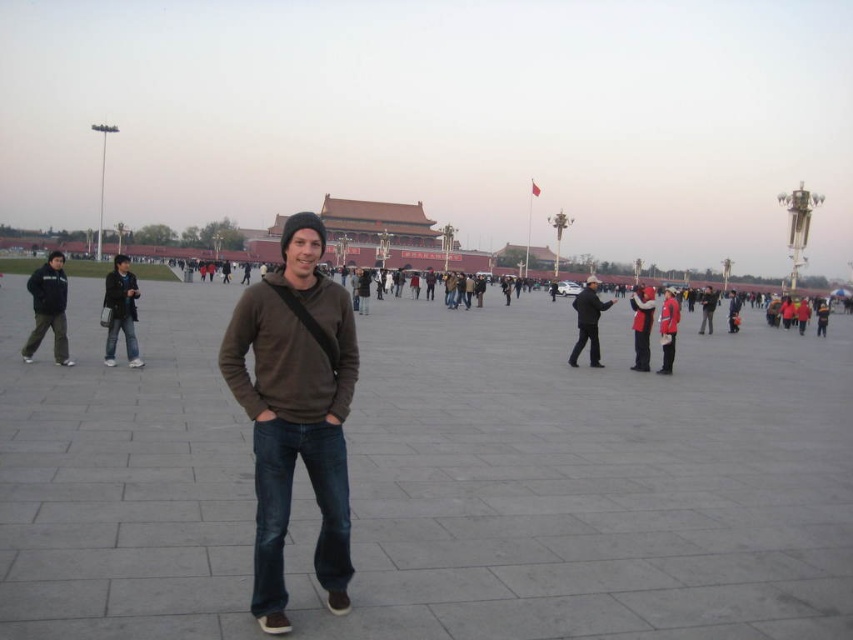
You are a fashion designer observing two jackets in the plaza scene. The jackets are labeled as the dark gray fleece jacket at left and the dark gray jacket at center. Which jacket appears shorter in the image?

The dark gray fleece jacket at left is shorter than the dark gray jacket at center.

You are standing at the point labeled point (589, 308) in the plaza. You want to walk straight ahead to the point labeled point (62, 356). Will you be moving towards the foreground or background of the image?

Since point (62, 356) is in front of point (589, 308), moving towards it means you are heading towards the foreground of the image.